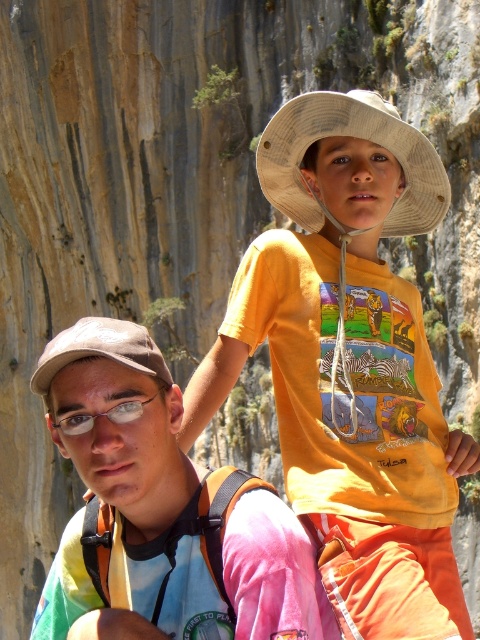
Does yellow cotton shirt at upper center appear under tie-dye fabric shirt at lower left?

No, yellow cotton shirt at upper center is not below tie-dye fabric shirt at lower left.

Is the position of yellow cotton shirt at upper center more distant than that of tie-dye fabric shirt at lower left?

That is True.

This screenshot has width=480, height=640. In order to click on yellow cotton shirt at upper center in this screenshot , I will do click(349, 349).

Locate an element on the screen. Image resolution: width=480 pixels, height=640 pixels. yellow cotton shirt at upper center is located at coordinates (349, 349).